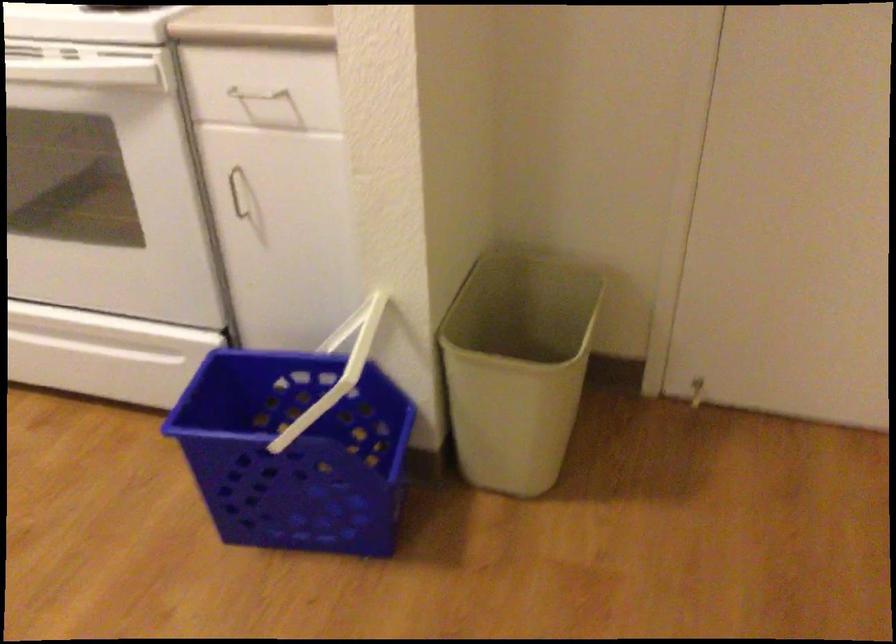
Image resolution: width=896 pixels, height=644 pixels. What are the coordinates of `cabinet door handle` in the screenshot? It's located at (237, 192).